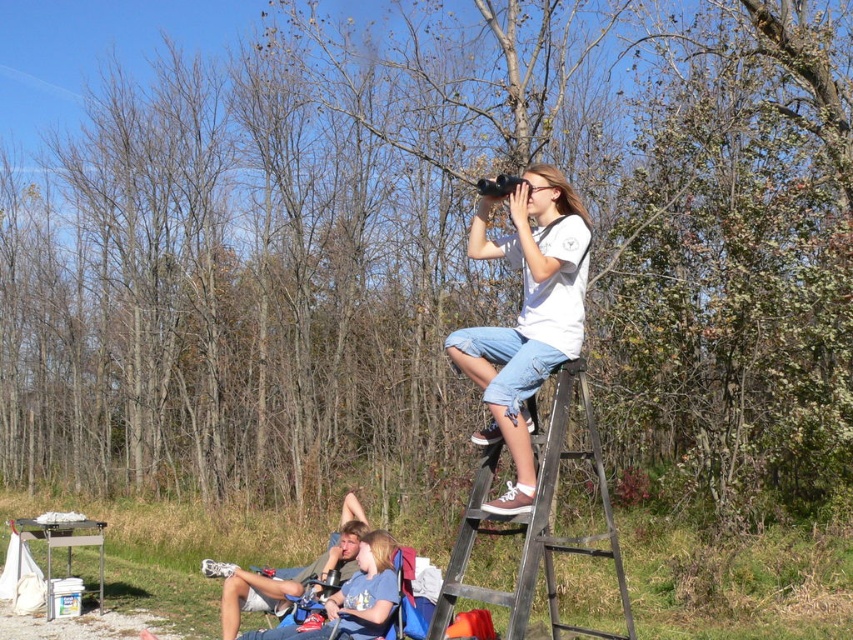
You are a photographer trying to capture a photo of the white cotton shirt at upper center and the denim shorts at lower left. Which object should you focus on first if you want to ensure both are in the frame without moving the camera?

The white cotton shirt at upper center is much taller than the denim shorts at lower left, so focusing on the taller object first would help ensure both are in the frame.